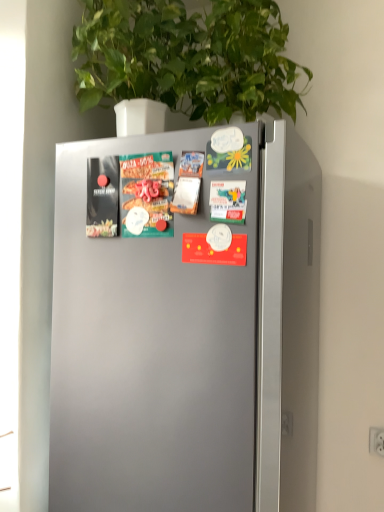
Where is `matte cardboard pizza box at center left`? Image resolution: width=384 pixels, height=512 pixels. matte cardboard pizza box at center left is located at coordinates (146, 195).

The image size is (384, 512). What do you see at coordinates (146, 195) in the screenshot? I see `matte cardboard pizza box at center left` at bounding box center [146, 195].

Where is `green leafy plant at upper center`? This screenshot has height=512, width=384. green leafy plant at upper center is located at coordinates (187, 57).

This screenshot has width=384, height=512. Describe the element at coordinates (187, 57) in the screenshot. I see `green leafy plant at upper center` at that location.

The height and width of the screenshot is (512, 384). Find the location of `matte cardboard pizza box at center left`. matte cardboard pizza box at center left is located at coordinates (146, 195).

Based on the photo, is matte cardboard pizza box at center left to the left of green leafy plant at upper center from the viewer's perspective?

Yes.

Between matte cardboard pizza box at center left and green leafy plant at upper center, which one is positioned in front?

Positioned in front is green leafy plant at upper center.

Which is farther from the camera, (158, 190) or (225, 55)?

The point (225, 55) is behind.

From the image's perspective, between matte cardboard pizza box at center left and green leafy plant at upper center, which one is located above?

green leafy plant at upper center is shown above in the image.

Based on the photo, from a real-world perspective, who is located lower, matte cardboard pizza box at center left or green leafy plant at upper center?

matte cardboard pizza box at center left, from a real-world perspective.

Considering the sizes of objects matte cardboard pizza box at center left and green leafy plant at upper center in the image provided, who is thinner, matte cardboard pizza box at center left or green leafy plant at upper center?

matte cardboard pizza box at center left is thinner.

Does matte cardboard pizza box at center left have a greater height compared to green leafy plant at upper center?

In fact, matte cardboard pizza box at center left may be shorter than green leafy plant at upper center.

Does matte cardboard pizza box at center left have a larger size compared to green leafy plant at upper center?

No, matte cardboard pizza box at center left is not bigger than green leafy plant at upper center.

Is matte cardboard pizza box at center left positioned beyond the bounds of green leafy plant at upper center?

Yes.

Is matte cardboard pizza box at center left with green leafy plant at upper center?

matte cardboard pizza box at center left and green leafy plant at upper center are clearly separated.

Is matte cardboard pizza box at center left aimed at green leafy plant at upper center?

No, matte cardboard pizza box at center left is not aimed at green leafy plant at upper center.

Find the location of `houseplant that appears in front of the matte cardboard pizza box at center left`. houseplant that appears in front of the matte cardboard pizza box at center left is located at coordinates coord(187,57).

Between green leafy plant at upper center and matte cardboard pizza box at center left, which one appears on the right side from the viewer's perspective?

From the viewer's perspective, green leafy plant at upper center appears more on the right side.

Based on the photo, is green leafy plant at upper center behind matte cardboard pizza box at center left?

No, it is not.

Is point (256, 23) in front of point (172, 234)?

That is False.

From the picture: From the image's perspective, which one is positioned lower, green leafy plant at upper center or matte cardboard pizza box at center left?

matte cardboard pizza box at center left.

From a real-world perspective, is green leafy plant at upper center located beneath matte cardboard pizza box at center left?

No.

Is green leafy plant at upper center wider or thinner than matte cardboard pizza box at center left?

green leafy plant at upper center is wider than matte cardboard pizza box at center left.

Based on the photo, is green leafy plant at upper center shorter than matte cardboard pizza box at center left?

Incorrect, the height of green leafy plant at upper center does not fall short of that of matte cardboard pizza box at center left.

Between green leafy plant at upper center and matte cardboard pizza box at center left, which one has larger size?

green leafy plant at upper center is bigger.

Is green leafy plant at upper center surrounding matte cardboard pizza box at center left?

That's incorrect, matte cardboard pizza box at center left is not inside green leafy plant at upper center.

Is the surface of green leafy plant at upper center in direct contact with matte cardboard pizza box at center left?

green leafy plant at upper center and matte cardboard pizza box at center left are clearly separated.

Is green leafy plant at upper center facing towards matte cardboard pizza box at center left?

No, green leafy plant at upper center is not turned towards matte cardboard pizza box at center left.

Find the location of a particular element. The image size is (384, 512). magazine below the green leafy plant at upper center (from the image's perspective) is located at coordinates (146, 195).

Locate an element on the screen. This screenshot has height=512, width=384. magazine on the left side of green leafy plant at upper center is located at coordinates (146, 195).

You are a GUI agent. You are given a task and a screenshot of the screen. Output one action in this format:
    pyautogui.click(x=<x>, y=<y>)
    Task: Click on the magazine behind the green leafy plant at upper center
    This screenshot has height=512, width=384.
    Given the screenshot: What is the action you would take?
    pyautogui.click(x=146, y=195)